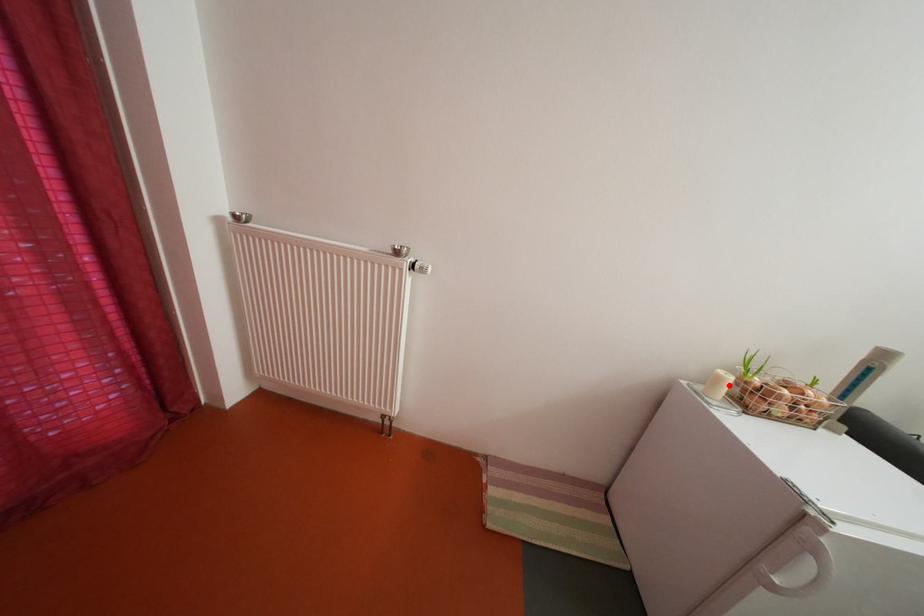
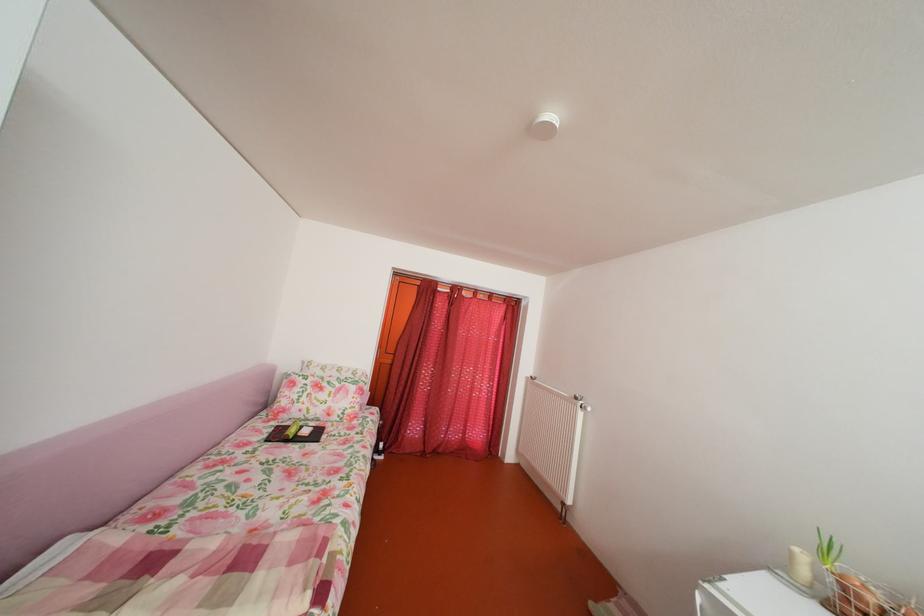
Locate, in the second image, the point that corresponds to the highlighted location in the first image.

(803, 561)